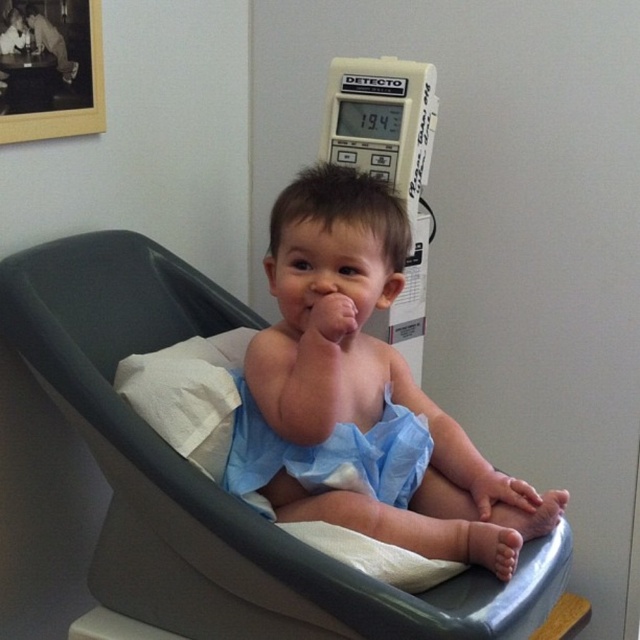
Describe the element at coordinates (209, 480) in the screenshot. I see `blue fabric feeding chair at center` at that location.

Can you confirm if blue fabric feeding chair at center is positioned below blue fabric cloth at center?

Indeed, blue fabric feeding chair at center is positioned under blue fabric cloth at center.

The width and height of the screenshot is (640, 640). Find the location of `blue fabric feeding chair at center`. blue fabric feeding chair at center is located at coordinates (209, 480).

This screenshot has width=640, height=640. What are the coordinates of `blue fabric feeding chair at center` in the screenshot? It's located at (209, 480).

Is blue fabric cloth at center taller than light blue cloth diaper at center?

Correct, blue fabric cloth at center is much taller as light blue cloth diaper at center.

Does blue fabric cloth at center appear on the right side of light blue cloth diaper at center?

Yes, blue fabric cloth at center is to the right of light blue cloth diaper at center.

The height and width of the screenshot is (640, 640). What are the coordinates of `blue fabric cloth at center` in the screenshot? It's located at (362, 394).

The width and height of the screenshot is (640, 640). Find the location of `blue fabric cloth at center`. blue fabric cloth at center is located at coordinates (362, 394).

Is blue fabric feeding chair at center to the right of light blue cloth diaper at center from the viewer's perspective?

In fact, blue fabric feeding chair at center is to the left of light blue cloth diaper at center.

Is point (100, 344) closer to camera compared to point (413, 465)?

No.

Is point (161, 280) positioned behind point (387, 420)?

Yes, point (161, 280) is farther from viewer.

Where is `blue fabric feeding chair at center`? blue fabric feeding chair at center is located at coordinates (209, 480).